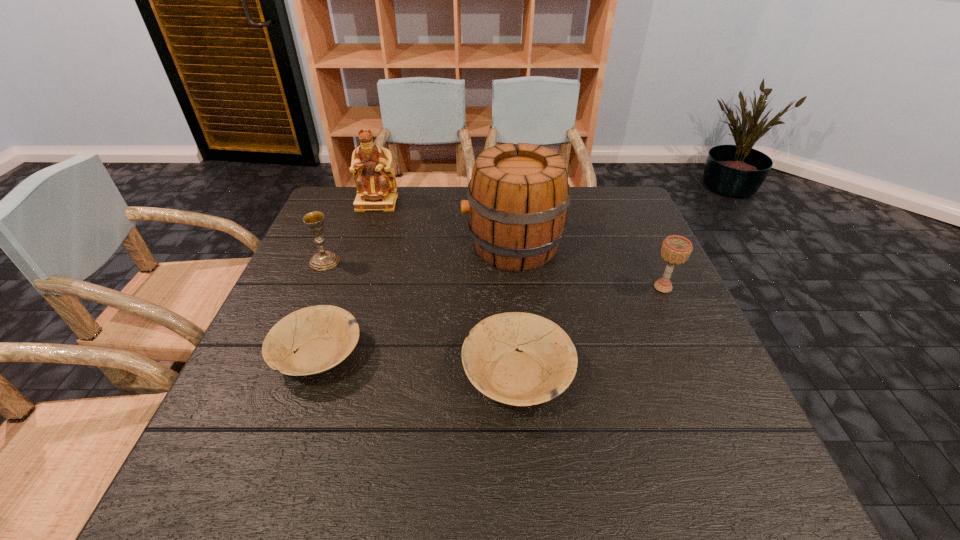
Locate an element on the screen. This screenshot has height=540, width=960. vacant point that satisfies the following two spatial constraints: 1. on the front-facing side of the figurine; 2. on the left side of the fourth farthest object is located at coordinates [348, 287].